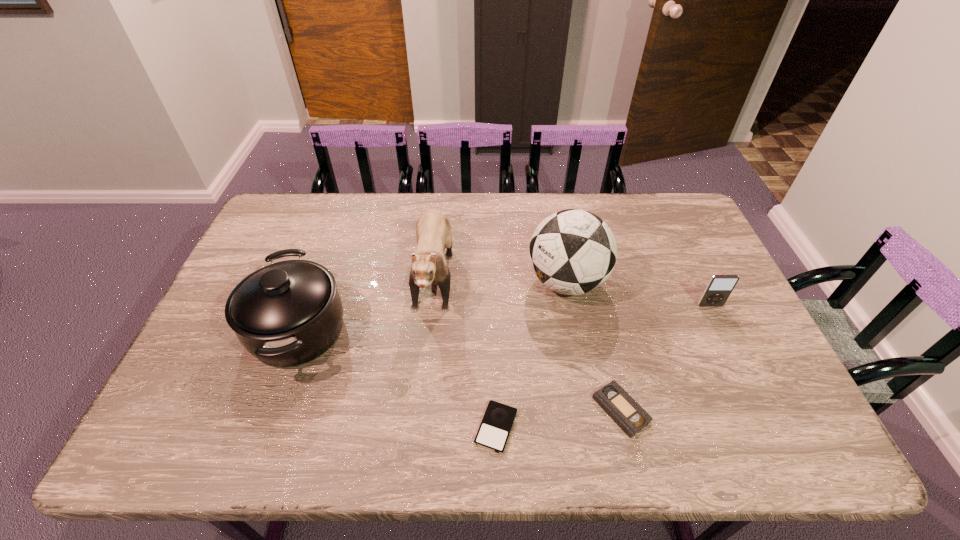
Locate an element on the screen. This screenshot has height=540, width=960. free space between the saucepan and the ferret is located at coordinates (366, 299).

Locate an element on the screen. vacant area between the soccer ball and the second object from left to right is located at coordinates (500, 274).

Identify the location of vacant space that is in between the left iPod and the ferret. (466, 347).

The image size is (960, 540). In order to click on vacant area that lies between the soccer ball and the fifth tallest object in this screenshot , I will do `click(593, 346)`.

Where is `vacant area that lies between the taller iPod and the videotape`? vacant area that lies between the taller iPod and the videotape is located at coordinates (665, 357).

Where is `free point between the videotape and the fifth object from right to left`? The height and width of the screenshot is (540, 960). free point between the videotape and the fifth object from right to left is located at coordinates (527, 339).

Locate an element on the screen. The height and width of the screenshot is (540, 960). free space between the second shortest object and the shortest object is located at coordinates (559, 418).

This screenshot has height=540, width=960. What are the coordinates of `object that is the fifth closest to the fifth object from right to left` in the screenshot? It's located at (719, 287).

Find the location of a particular element. object that stands as the fifth closest to the fifth tallest object is located at coordinates (288, 313).

Identify the location of blank area in the image that satisfies the following two spatial constraints: 1. on the face of the shortest object; 2. on the right side of the ferret. The width and height of the screenshot is (960, 540). (418, 427).